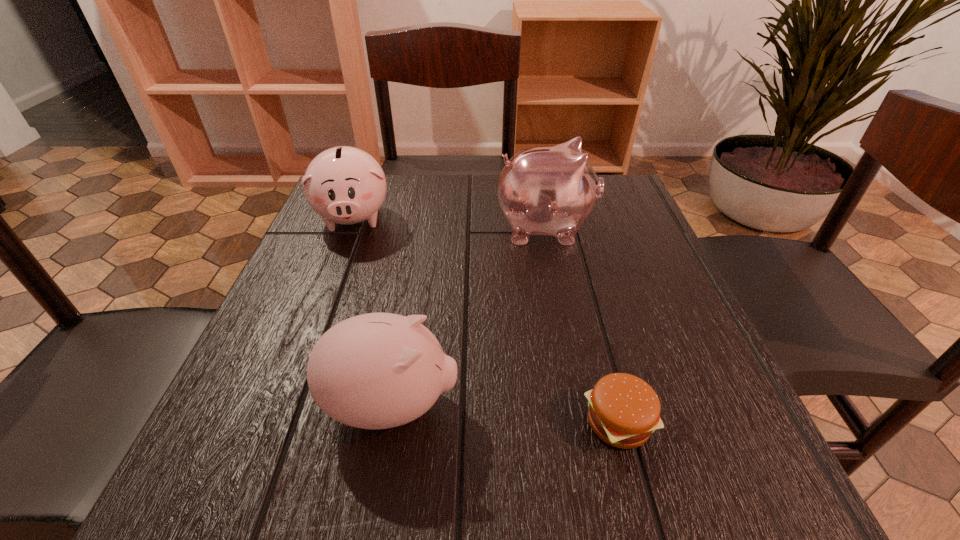
Locate an element on the screen. This screenshot has height=540, width=960. hamburger that is at the right edge is located at coordinates (624, 410).

You are a GUI agent. You are given a task and a screenshot of the screen. Output one action in this format:
    pyautogui.click(x=<x>, y=<y>)
    Task: Click on the object that is positioned at the far left corner
    Image resolution: width=960 pixels, height=540 pixels.
    Given the screenshot: What is the action you would take?
    pyautogui.click(x=344, y=185)

At what (x,y) coordinates should I click in order to perform the action: click on object located in the near left corner section of the desktop. Please return your answer as a coordinate pair (x, y). The height and width of the screenshot is (540, 960). Looking at the image, I should click on (377, 370).

Find the location of a particular element. This screenshot has height=540, width=960. object located in the far right corner section of the desktop is located at coordinates (551, 190).

Image resolution: width=960 pixels, height=540 pixels. I want to click on object that is positioned at the near right corner, so click(x=624, y=410).

Where is `vacant space at the far edge of the desktop`? The image size is (960, 540). vacant space at the far edge of the desktop is located at coordinates (440, 191).

Image resolution: width=960 pixels, height=540 pixels. In the image, there is a desktop. In order to click on vacant space at the left edge in this screenshot , I will do `click(310, 312)`.

You are a GUI agent. You are given a task and a screenshot of the screen. Output one action in this format:
    pyautogui.click(x=<x>, y=<y>)
    Task: Click on the free spot at the right edge of the desktop
    
    Given the screenshot: What is the action you would take?
    pyautogui.click(x=609, y=229)

This screenshot has width=960, height=540. Find the location of `vacant space at the near left corner of the desktop`. vacant space at the near left corner of the desktop is located at coordinates (309, 471).

The width and height of the screenshot is (960, 540). Find the location of `vacant space at the near right corner of the desktop`. vacant space at the near right corner of the desktop is located at coordinates (686, 454).